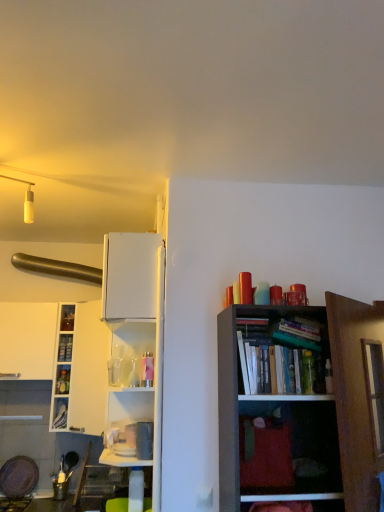
Question: In terms of size, does white glossy cabinet at left, which is counted as the second cabinet, starting from the bottom, appear bigger or smaller than hardcover book at upper right, the 2th book when ordered from left to right?

Choices:
 (A) big
 (B) small

Answer: (B)

Question: Would you say white glossy cabinet at left, the 1th cabinet when ordered from top to bottom, is to the left or to the right of hardcover book at upper right, which is counted as the 1th book, starting from the right, in the picture?

Choices:
 (A) left
 (B) right

Answer: (A)

Question: Which of these objects is positioned closest to the hardcover book at left, the 2th book viewed from the right?

Choices:
 (A) white matte cabinet at left
 (B) white glossy cabinet at left
 (C) hardcover book at upper right, which ranks as the first book in front-to-back order
 (D) white glossy cabinet at left, which is counted as the second cabinet, starting from the bottom
 (E) metallic blue cabinet at left, placed as the 1th cabinet when sorted from bottom to top

Answer: (D)

Question: Based on their relative distances, which object is farther from the metallic blue cabinet at left, which is the 2th cabinet from top to bottom?

Choices:
 (A) white glossy cabinet at left, which is counted as the second cabinet, starting from the bottom
 (B) hardcover book at upper right, marked as the 2th book in a bottom-to-top arrangement
 (C) brushed metal exhaust hood at upper left
 (D) white glossy cabinet at left
 (E) white matte cabinet at left

Answer: (B)